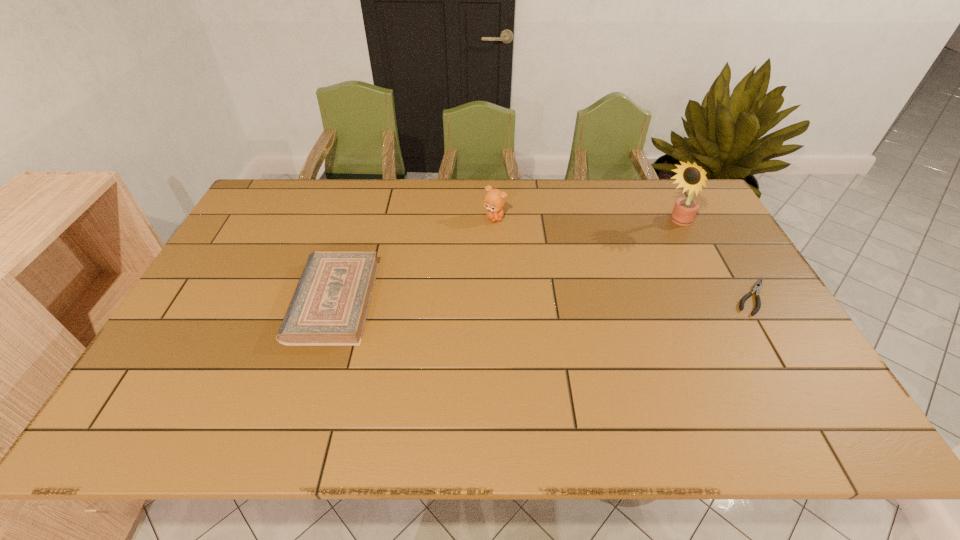
The width and height of the screenshot is (960, 540). In order to click on vacant space located on the face of the tallest object in this screenshot , I will do [648, 244].

At what (x,y) coordinates should I click in order to perform the action: click on vacant space located on the face of the tallest object. Please return your answer as a coordinate pair (x, y). This screenshot has width=960, height=540. Looking at the image, I should click on (654, 240).

Locate an element on the screen. vacant space located on the face of the tallest object is located at coordinates (604, 274).

The width and height of the screenshot is (960, 540). Find the location of `vacant space located on the face of the second object from left to right`. vacant space located on the face of the second object from left to right is located at coordinates (538, 305).

The height and width of the screenshot is (540, 960). I want to click on vacant space situated 0.270m on the face of the second object from left to right, so click(x=526, y=282).

Locate an element on the screen. This screenshot has width=960, height=540. vacant region located on the face of the second object from left to right is located at coordinates (534, 297).

Where is `sunflower that is at the far edge`? This screenshot has width=960, height=540. sunflower that is at the far edge is located at coordinates (692, 177).

Locate an element on the screen. This screenshot has height=540, width=960. teddy bear that is at the far edge is located at coordinates (494, 200).

Where is `pliers that is positioned at the right edge`? pliers that is positioned at the right edge is located at coordinates (757, 286).

You are a GUI agent. You are given a task and a screenshot of the screen. Output one action in this format:
    pyautogui.click(x=<x>, y=<y>)
    Task: Click on the sunflower that is at the right edge
    The image size is (960, 540).
    Given the screenshot: What is the action you would take?
    692,177